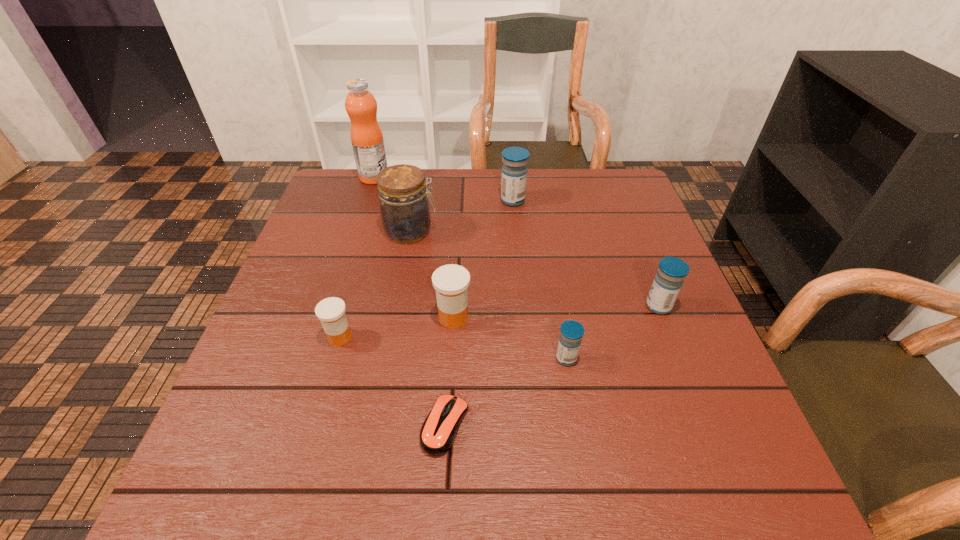
The width and height of the screenshot is (960, 540). I want to click on free point located 0.300m on the left of the rightmost blue medicine, so click(x=509, y=306).

At what (x,y) coordinates should I click in order to perform the action: click on free space located 0.260m on the label of the leftmost medicine. Please return your answer as a coordinate pair (x, y). This screenshot has width=960, height=540. Looking at the image, I should click on (299, 480).

The width and height of the screenshot is (960, 540). Find the location of `vacant space located on the right of the second nearest object`. vacant space located on the right of the second nearest object is located at coordinates (698, 359).

Identify the location of free space located on the back of the computer mouse. The height and width of the screenshot is (540, 960). [x=451, y=322].

Identify the location of fruit juice located in the far edge section of the desktop. (366, 135).

Image resolution: width=960 pixels, height=540 pixels. Find the location of `medicine that is at the far edge`. medicine that is at the far edge is located at coordinates (514, 170).

The height and width of the screenshot is (540, 960). I want to click on object that is at the near edge, so click(438, 432).

In order to click on fruit juice that is at the left edge in this screenshot , I will do `click(366, 135)`.

This screenshot has width=960, height=540. In order to click on medicine that is at the left edge in this screenshot , I will do 331,311.

Identify the location of object located in the right edge section of the desktop. This screenshot has width=960, height=540. (668, 281).